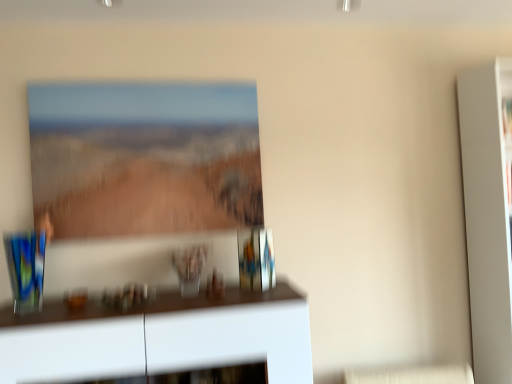
Find the location of a particular element. free point to the left of translucent glass vase at center is located at coordinates (156, 287).